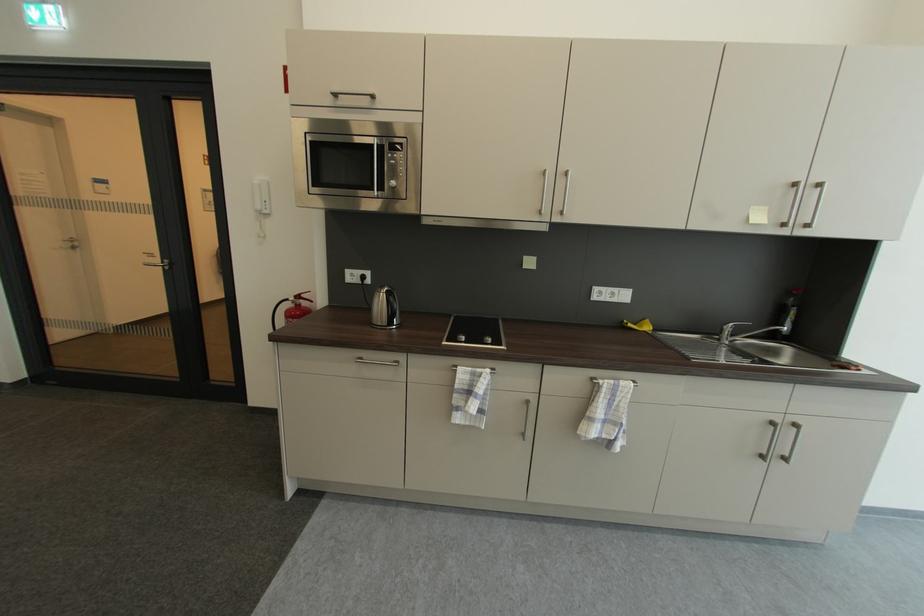
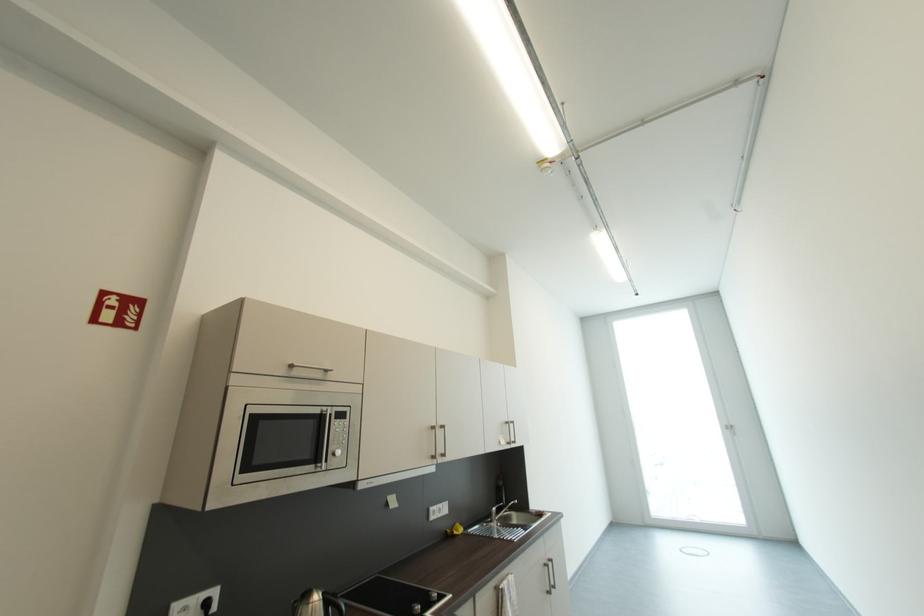
Locate, in the second image, the point that corresponds to point 779,424 in the first image.

(552, 567)